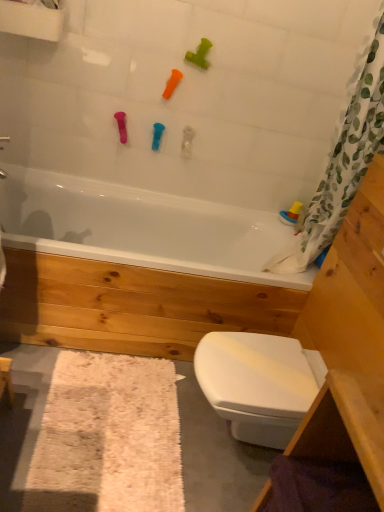
What is the approximate width of white shaggy bath mat at lower left?

white shaggy bath mat at lower left is 21.76 inches wide.

In order to click on translucent plastic boat at right, marked as the first toy in a bottom-to-top arrangement in this screenshot , I will do `click(291, 214)`.

What do you see at coordinates (141, 227) in the screenshot?
I see `white glossy bathtub at center` at bounding box center [141, 227].

I want to click on white shaggy bath mat at lower left, so click(x=108, y=437).

Between white glossy bathtub at center and blue rubber toy at upper center, the first toy from the left, which one appears on the right side from the viewer's perspective?

Positioned to the right is blue rubber toy at upper center, the first toy from the left.

Considering the positions of objects white glossy bathtub at center and blue rubber toy at upper center, placed as the second toy when sorted from back to front, in the image provided, who is behind, white glossy bathtub at center or blue rubber toy at upper center, placed as the second toy when sorted from back to front,?

Positioned behind is blue rubber toy at upper center, placed as the second toy when sorted from back to front.

Is white glossy bathtub at center positioned beyond the bounds of blue rubber toy at upper center, placed as the second toy when sorted from back to front?

white glossy bathtub at center lies outside blue rubber toy at upper center, placed as the second toy when sorted from back to front,'s area.

From the picture: From the image's perspective, which is above, white glossy bathtub at center or blue rubber toy at upper center, positioned as the third toy in front-to-back order?

blue rubber toy at upper center, positioned as the third toy in front-to-back order, is shown above in the image.

Is blue rubber toy at upper center, positioned as the third toy in front-to-back order, next to orange rubber toy at upper center, the third toy positioned from the bottom, and touching it?

There is a gap between blue rubber toy at upper center, positioned as the third toy in front-to-back order, and orange rubber toy at upper center, the third toy positioned from the bottom.

Which is behind, blue rubber toy at upper center, positioned as the third toy in front-to-back order, or orange rubber toy at upper center, the 2th toy from the top?

Positioned behind is blue rubber toy at upper center, positioned as the third toy in front-to-back order.

Can you confirm if blue rubber toy at upper center, arranged as the fourth toy when viewed from the right, is wider than orange rubber toy at upper center, the 2th toy positioned from the left?

No.

Is blue rubber toy at upper center, the first toy from the left, oriented towards orange rubber toy at upper center, the 2th toy from the top?

No, blue rubber toy at upper center, the first toy from the left, is not aimed at orange rubber toy at upper center, the 2th toy from the top.

Considering the relative positions of translucent plastic boat at right, the 1th toy in the back-to-front sequence, and white shaggy bath mat at lower left in the image provided, is translucent plastic boat at right, the 1th toy in the back-to-front sequence, to the left or to the right of white shaggy bath mat at lower left?

Clearly, translucent plastic boat at right, the 1th toy in the back-to-front sequence, is on the right of white shaggy bath mat at lower left in the image.

Find the location of a particular element. Image resolution: width=384 pixels, height=512 pixels. toy that is the 1st object located above the white shaggy bath mat at lower left (from the image's perspective) is located at coordinates (291, 214).

From the picture: Which is closer to the camera, (301,203) or (91,474)?

Clearly, point (301,203) is more distant from the camera than point (91,474).

Is white shaggy bath mat at lower left completely or partially inside translucent plastic boat at right, acting as the fourth toy starting from the front?

No.

Considering the sizes of objects white glossy bidet at lower right and white shaggy bath mat at lower left in the image provided, who is thinner, white glossy bidet at lower right or white shaggy bath mat at lower left?

white glossy bidet at lower right is thinner.

Find the location of a particular element. The image size is (384, 512). bidet lying above the white shaggy bath mat at lower left (from the image's perspective) is located at coordinates (258, 383).

From a real-world perspective, who is located lower, white glossy bidet at lower right or white shaggy bath mat at lower left?

white shaggy bath mat at lower left is physically lower.

Can you confirm if translucent plastic boat at right, the first toy in the right-to-left sequence, is smaller than green rubber toy at upper center, the first toy from the front?

Indeed, translucent plastic boat at right, the first toy in the right-to-left sequence, has a smaller size compared to green rubber toy at upper center, the first toy from the front.

I want to click on the 3rd toy below when counting from the green rubber toy at upper center, the first toy from the front (from the image's perspective), so click(x=291, y=214).

Is translucent plastic boat at right, acting as the fourth toy starting from the front, looking in the opposite direction of green rubber toy at upper center, the fourth toy when ordered from bottom to top?

No, translucent plastic boat at right, acting as the fourth toy starting from the front, is not facing the opposite direction of green rubber toy at upper center, the fourth toy when ordered from bottom to top.

Which is in front, translucent plastic boat at right, the 1th toy in the back-to-front sequence, or green rubber toy at upper center, the fourth toy when ordered from bottom to top?

Positioned in front is green rubber toy at upper center, the fourth toy when ordered from bottom to top.

From a real-world perspective, relative to white glossy bathtub at center, is blue rubber toy at upper center, placed as the second toy when sorted from back to front, vertically above or below?

In terms of real-world spatial position, blue rubber toy at upper center, placed as the second toy when sorted from back to front, is above white glossy bathtub at center.

Is the depth of blue rubber toy at upper center, the first toy from the left, less than that of white glossy bathtub at center?

No, blue rubber toy at upper center, the first toy from the left, is further to the viewer.

The height and width of the screenshot is (512, 384). I want to click on bathtub that is below the blue rubber toy at upper center, arranged as the fourth toy when viewed from the right (from the image's perspective), so click(141, 227).

Can you confirm if blue rubber toy at upper center, the first toy from the left, is shorter than white glossy bathtub at center?

Indeed, blue rubber toy at upper center, the first toy from the left, has a lesser height compared to white glossy bathtub at center.

Is white glossy bidet at lower right bigger than green rubber toy at upper center, placed as the 4th toy when sorted from back to front?

Yes.

In terms of height, does white glossy bidet at lower right look taller or shorter compared to green rubber toy at upper center, the third toy when ordered from left to right?

Considering their sizes, white glossy bidet at lower right has more height than green rubber toy at upper center, the third toy when ordered from left to right.

Which is more to the right, white glossy bidet at lower right or green rubber toy at upper center, the third toy when ordered from left to right?

Positioned to the right is white glossy bidet at lower right.

The width and height of the screenshot is (384, 512). There is a white glossy bathtub at center. What are the coordinates of `the 2nd toy above it (from a real-world perspective)` in the screenshot? It's located at (157, 135).

This screenshot has height=512, width=384. I want to click on toy lying on the left of orange rubber toy at upper center, which is the third toy from back to front, so click(x=157, y=135).

When comparing their distances from green rubber toy at upper center, which ranks as the first toy in top-to-bottom order, does blue rubber toy at upper center, which appears as the third toy when viewed from the top, or white shaggy bath mat at lower left seem closer?

The object closer to green rubber toy at upper center, which ranks as the first toy in top-to-bottom order, is blue rubber toy at upper center, which appears as the third toy when viewed from the top.

Looking at the image, which one is located further to orange rubber toy at upper center, the 3th toy from the right, translucent plastic boat at right, the first toy in the right-to-left sequence, or white glossy bathtub at center?

translucent plastic boat at right, the first toy in the right-to-left sequence, is further to orange rubber toy at upper center, the 3th toy from the right.

When comparing their distances from white glossy bathtub at center, does green rubber toy at upper center, the first toy from the front, or orange rubber toy at upper center, which is the third toy from back to front, seem closer?

Among the two, orange rubber toy at upper center, which is the third toy from back to front, is located nearer to white glossy bathtub at center.

Which object lies further to the anchor point orange rubber toy at upper center, which is the third toy from back to front, blue rubber toy at upper center, marked as the second toy in a bottom-to-top arrangement, or white shaggy bath mat at lower left?

The object further to orange rubber toy at upper center, which is the third toy from back to front, is white shaggy bath mat at lower left.

From the picture: Considering their positions, is white shaggy bath mat at lower left positioned further to orange rubber toy at upper center, the 2th toy from the top, than green rubber toy at upper center, the 2th toy viewed from the right?

white shaggy bath mat at lower left is further to orange rubber toy at upper center, the 2th toy from the top.

From the image, which object appears to be farther from white glossy bidet at lower right, white glossy bathtub at center or translucent plastic boat at right, the first toy in the right-to-left sequence?

white glossy bathtub at center.

Looking at the image, which one is located further to translucent plastic boat at right, acting as the fourth toy starting from the front, orange rubber toy at upper center, the 2th toy positioned from the left, or white glossy bathtub at center?

orange rubber toy at upper center, the 2th toy positioned from the left, is further to translucent plastic boat at right, acting as the fourth toy starting from the front.

Based on their spatial positions, is blue rubber toy at upper center, placed as the second toy when sorted from back to front, or white glossy bidet at lower right closer to orange rubber toy at upper center, the 2th toy positioned from the left?

blue rubber toy at upper center, placed as the second toy when sorted from back to front, is positioned closer to the anchor orange rubber toy at upper center, the 2th toy positioned from the left.

Identify the location of bathtub between white shaggy bath mat at lower left and translucent plastic boat at right, the 1th toy in the back-to-front sequence, along the z-axis. [x=141, y=227].

You are a GUI agent. You are given a task and a screenshot of the screen. Output one action in this format:
    pyautogui.click(x=<x>, y=<y>)
    Task: Click on the bidet between blue rubber toy at upper center, marked as the second toy in a bottom-to-top arrangement, and white shaggy bath mat at lower left, in the vertical direction
    The image size is (384, 512).
    Given the screenshot: What is the action you would take?
    pyautogui.click(x=258, y=383)

Image resolution: width=384 pixels, height=512 pixels. Identify the location of bathtub between green rubber toy at upper center, the first toy from the front, and white shaggy bath mat at lower left, in the vertical direction. (141, 227).

Find the location of `bathtub between blue rubber toy at upper center, marked as the second toy in a bottom-to-top arrangement, and white shaggy bath mat at lower left, in the vertical direction`. bathtub between blue rubber toy at upper center, marked as the second toy in a bottom-to-top arrangement, and white shaggy bath mat at lower left, in the vertical direction is located at coordinates (141, 227).